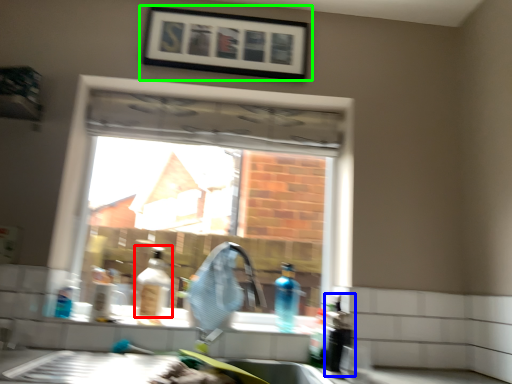
Question: Which object is positioned closest to bottle (highlighted by a red box)? Select from bottle (highlighted by a blue box) and picture frame (highlighted by a green box).

Choices:
 (A) bottle
 (B) picture frame

Answer: (A)